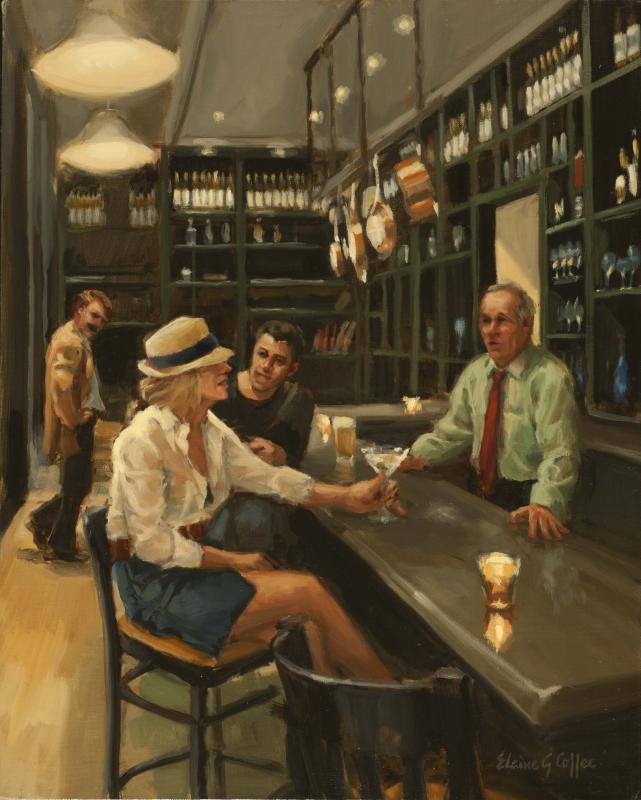
Locate an element on the screen. beer glass is located at coordinates (343, 448).